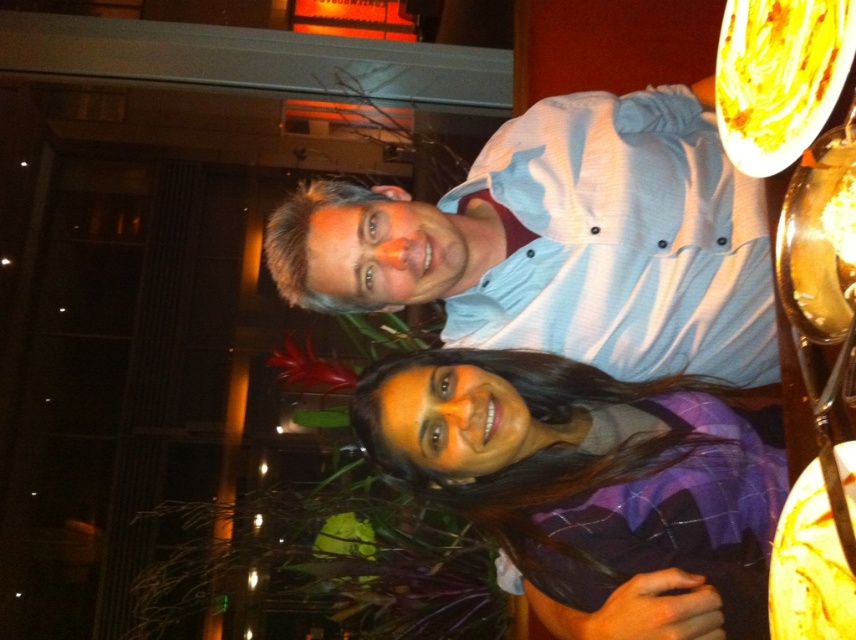
Who is more forward, (x=488, y=308) or (x=539, y=593)?

Positioned in front is point (x=539, y=593).

Who is shorter, light blue button-up shirt at center or purple plaid shirt at center?

Standing shorter between the two is purple plaid shirt at center.

Find the location of a particular element. This screenshot has width=856, height=640. light blue button-up shirt at center is located at coordinates (562, 243).

Identify the location of light blue button-up shirt at center. (562, 243).